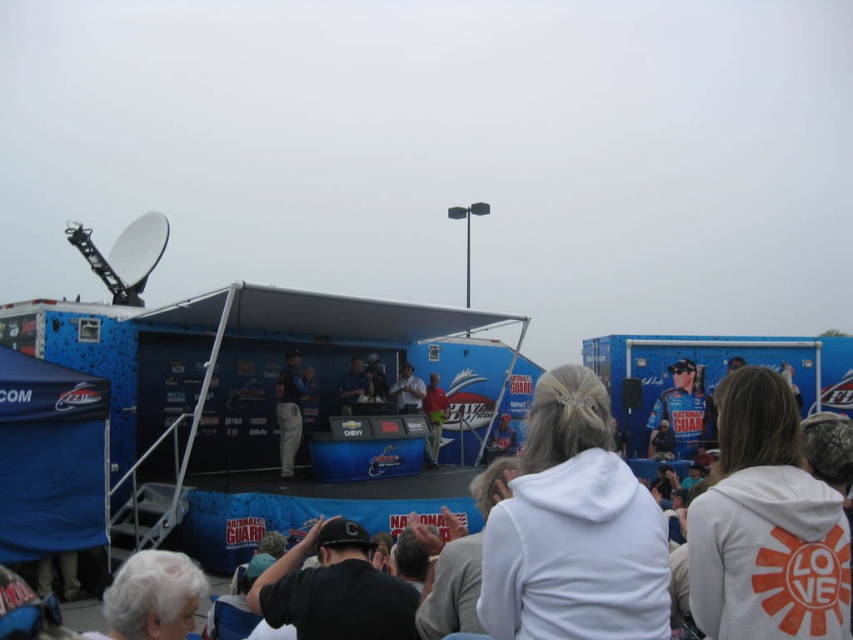
Question: Which point appears closest to the camera in this image?

Choices:
 (A) (404, 406)
 (B) (437, 406)
 (C) (788, 516)

Answer: (C)

Question: Which point is farther to the camera?

Choices:
 (A) matte red shirt at center
 (B) blue fabric jacket at center
 (C) light gray fabric jacket at center

Answer: (B)

Question: Is white fleece jacket at lower right closer to camera compared to matte red shirt at center?

Choices:
 (A) yes
 (B) no

Answer: (A)

Question: Which object is positioned closest to the white fleece jacket at center?

Choices:
 (A) blue fabric jacket at center
 (B) light gray fabric jacket at center
 (C) white cotton shirt at center
 (D) white fleece jacket at lower right

Answer: (D)

Question: Does white fleece sweatshirt at center have a greater width compared to blue fabric jacket at center?

Choices:
 (A) no
 (B) yes

Answer: (B)

Question: In this image, where is blue fabric jacket at center located relative to matte red shirt at center?

Choices:
 (A) above
 (B) below

Answer: (B)